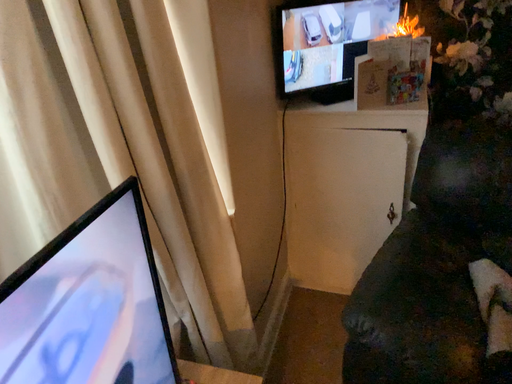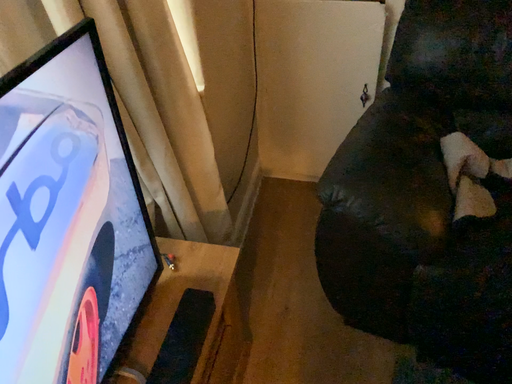
Question: Which way did the camera rotate in the video?

Choices:
 (A) rotated downward
 (B) rotated upward

Answer: (A)